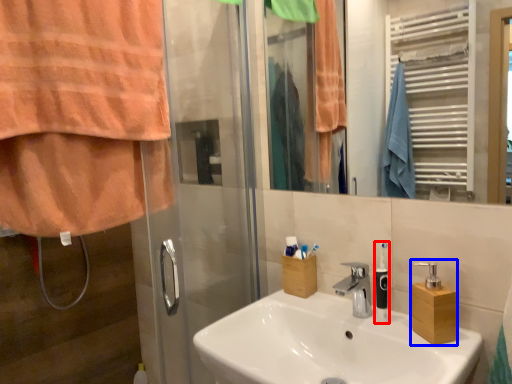
Question: Which object appears closest to the camera in this image, soap dispenser (highlighted by a red box) or soap dispenser (highlighted by a blue box)?

Choices:
 (A) soap dispenser
 (B) soap dispenser

Answer: (B)